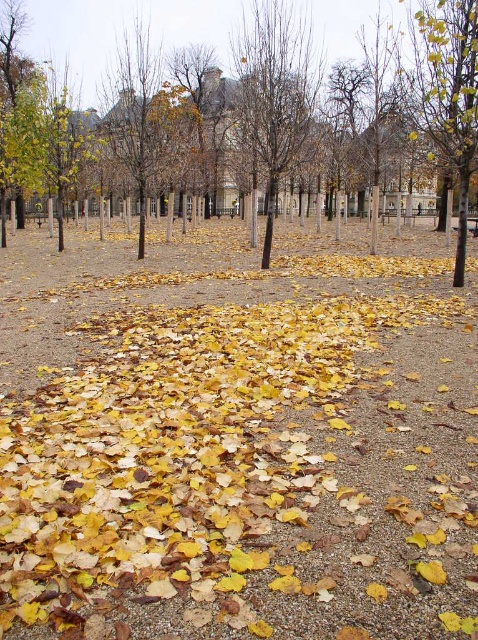
Question: Is bare branches at center below yellow-green leaves at upper right?

Choices:
 (A) yes
 (B) no

Answer: (B)

Question: From the image, what is the correct spatial relationship of yellow dry leaves at center in relation to yellow-green leaves at upper right?

Choices:
 (A) above
 (B) below

Answer: (B)

Question: Among these points, which one is farthest from the camera?

Choices:
 (A) (283, 35)
 (B) (469, 390)
 (C) (459, 157)
 (D) (467, 20)

Answer: (A)

Question: Which point appears closest to the camera in this image?

Choices:
 (A) (316, 342)
 (B) (378, 20)
 (C) (443, 138)

Answer: (A)

Question: Which point appears farthest from the camera in this image?

Choices:
 (A) (358, 636)
 (B) (424, 13)
 (C) (296, 120)
 (D) (301, 122)

Answer: (D)

Question: Can you confirm if yellow dry leaves at center is positioned to the right of yellow leafy tree at center?

Choices:
 (A) yes
 (B) no

Answer: (B)